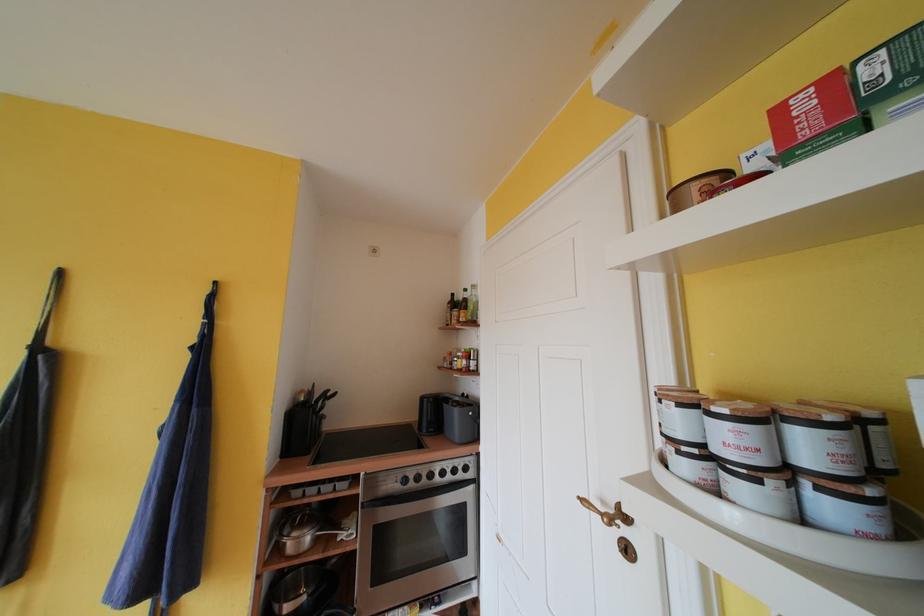
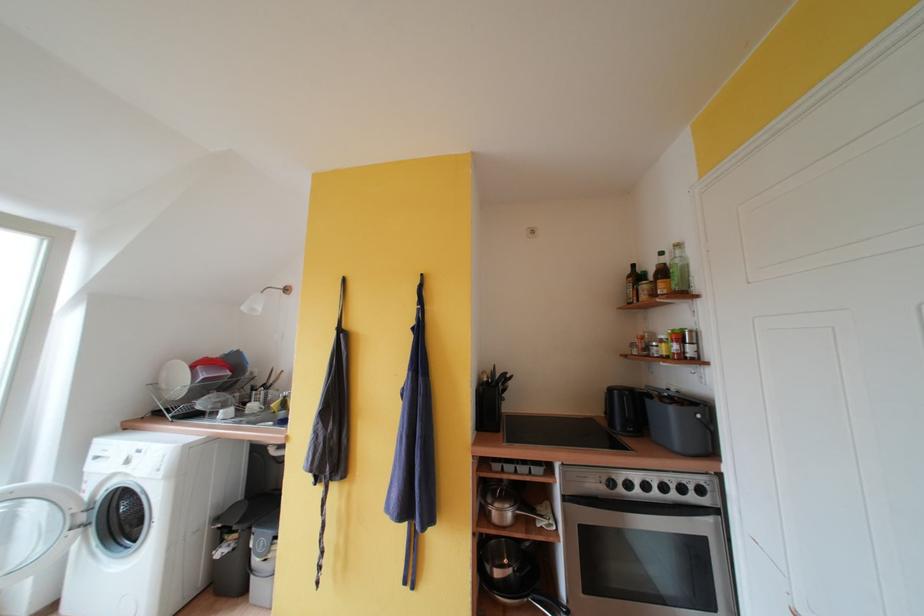
In the second image, find the point that corresponds to point (223, 286) in the first image.

(428, 278)